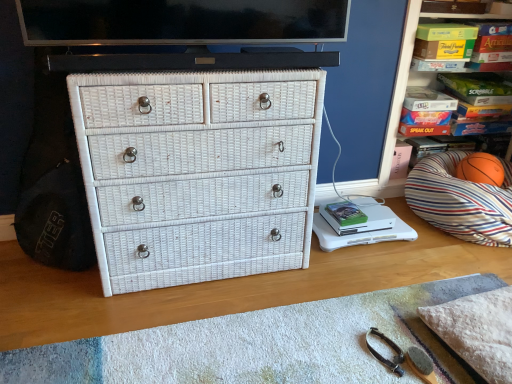
Question: From a real-world perspective, does white plastic changing table at lower right stand above orange rubber basketball at right?

Choices:
 (A) yes
 (B) no

Answer: (B)

Question: Are white plastic changing table at lower right and orange rubber basketball at right beside each other?

Choices:
 (A) yes
 (B) no

Answer: (B)

Question: Considering the relative positions of white plastic changing table at lower right and orange rubber basketball at right in the image provided, is white plastic changing table at lower right to the left of orange rubber basketball at right from the viewer's perspective?

Choices:
 (A) yes
 (B) no

Answer: (A)

Question: Does white plastic changing table at lower right come behind orange rubber basketball at right?

Choices:
 (A) yes
 (B) no

Answer: (B)

Question: From the image's perspective, is white plastic changing table at lower right under orange rubber basketball at right?

Choices:
 (A) no
 (B) yes

Answer: (B)

Question: Can you confirm if white plastic changing table at lower right is taller than orange rubber basketball at right?

Choices:
 (A) yes
 (B) no

Answer: (B)

Question: From the image's perspective, is orange rubber basketball at right beneath striped fabric pillow at right?

Choices:
 (A) yes
 (B) no

Answer: (B)

Question: From the image's perspective, is orange rubber basketball at right over striped fabric pillow at right?

Choices:
 (A) yes
 (B) no

Answer: (A)

Question: Can you confirm if orange rubber basketball at right is wider than striped fabric pillow at right?

Choices:
 (A) yes
 (B) no

Answer: (B)

Question: From a real-world perspective, does orange rubber basketball at right sit lower than striped fabric pillow at right?

Choices:
 (A) no
 (B) yes

Answer: (A)

Question: Does orange rubber basketball at right have a smaller size compared to striped fabric pillow at right?

Choices:
 (A) yes
 (B) no

Answer: (A)

Question: Is orange rubber basketball at right bigger than striped fabric pillow at right?

Choices:
 (A) yes
 (B) no

Answer: (B)

Question: Is green matte book at center positioned behind orange rubber basketball at right?

Choices:
 (A) yes
 (B) no

Answer: (B)